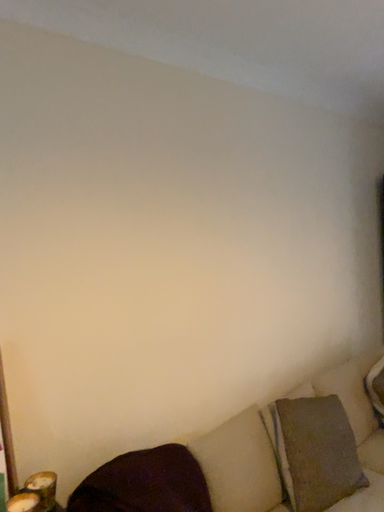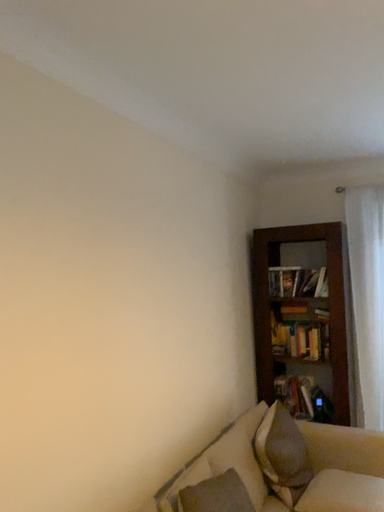
Question: How did the camera likely rotate when shooting the video?

Choices:
 (A) rotated upward
 (B) rotated downward

Answer: (A)